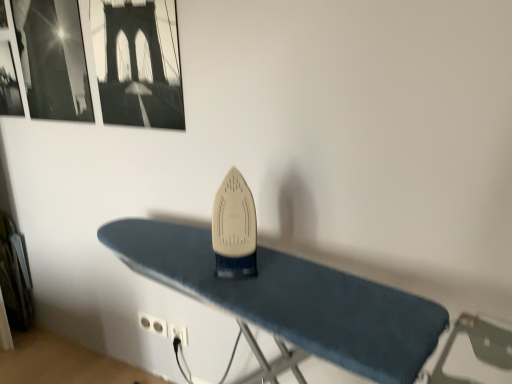
The width and height of the screenshot is (512, 384). Identify the location of empty space that is to the right of white plastic iron at center. (300, 276).